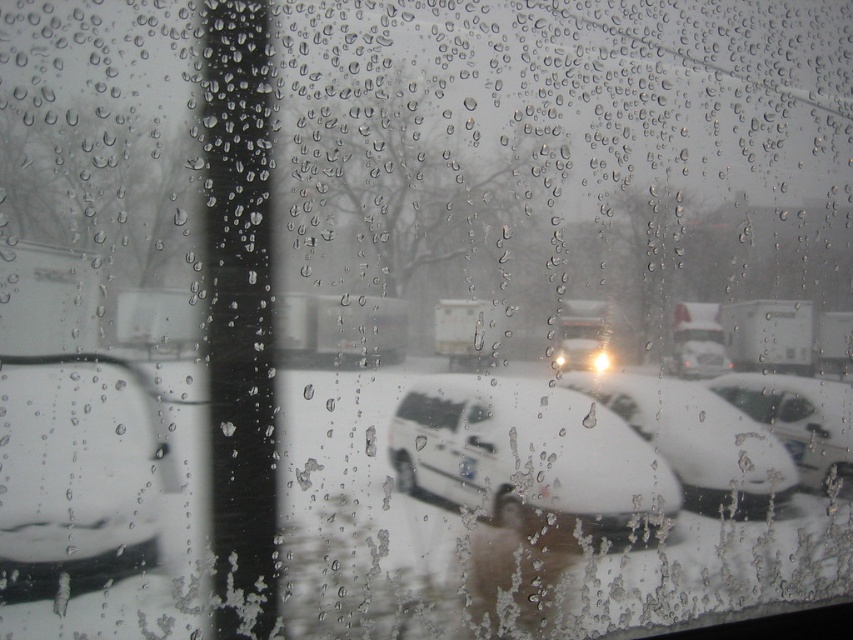
You are a delivery driver who needs to park your white matte car at center in a specific spot. The parking spot is located at point 0.688, 0.819. Is your car already parked in the correct spot?

Yes, the white matte car at center is already parked at point (698, 440), so it is in the correct spot.

You are a delivery person who needs to park your delivery truck between the white matte van at center and the white matte car at center. The truck requires 5.5 inches of space to fit. Can you park your truck there?

The distance between the white matte van at center and the white matte car at center is 6.04 inches, which is more than enough to accommodate the delivery truck requiring 5.5 inches of space.

You are a delivery driver who needs to park your truck. You see a white matte car at left and a white matte van at center through the icy window. Which vehicle takes up more space in the parking spot?

The white matte van at center takes up more space in the parking spot because it is larger than the white matte car at left.